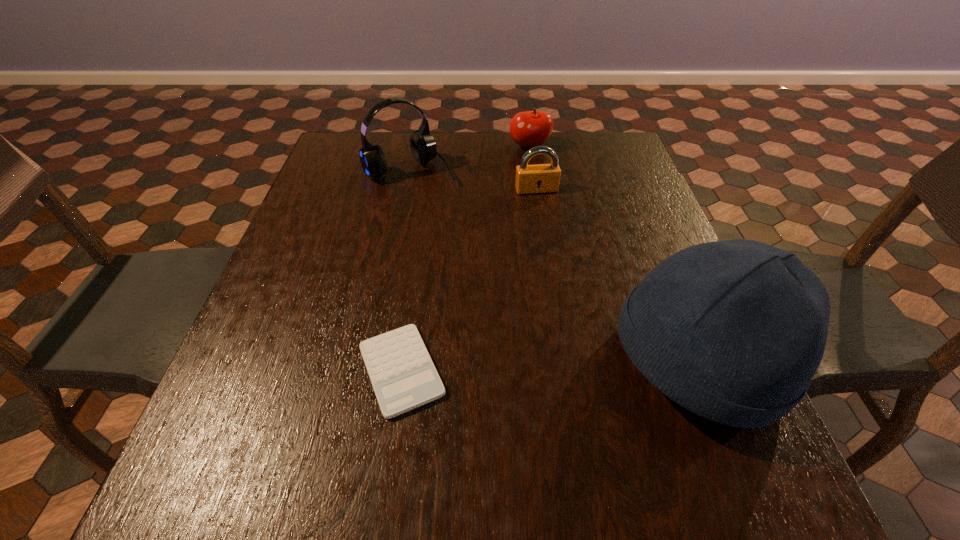
The width and height of the screenshot is (960, 540). In order to click on free space between the second tallest object and the shortest object in this screenshot , I will do `click(406, 270)`.

At what (x,y) coordinates should I click in order to perform the action: click on object that is the closest one to the fourth shortest object. Please return your answer as a coordinate pair (x, y). The height and width of the screenshot is (540, 960). Looking at the image, I should click on (533, 128).

Identify which object is the fourth nearest to the padlock. Please provide its 2D coordinates. Your answer should be formatted as a tuple, i.e. [(x, y)], where the tuple contains the x and y coordinates of a point satisfying the conditions above.

[(403, 376)]

Find the location of `free point that satisfies the following two spatial constraints: 1. on the front side of the tallest object; 2. on the right side of the padlock`. free point that satisfies the following two spatial constraints: 1. on the front side of the tallest object; 2. on the right side of the padlock is located at coordinates (563, 362).

Locate an element on the screen. The height and width of the screenshot is (540, 960). vacant point that satisfies the following two spatial constraints: 1. on the front side of the padlock; 2. on the right side of the rightmost object is located at coordinates [x=563, y=362].

Identify the location of vacant position in the image that satisfies the following two spatial constraints: 1. on the back side of the shortest object; 2. on the left side of the rightmost object. (402, 362).

The height and width of the screenshot is (540, 960). Find the location of `vacant region that satisfies the following two spatial constraints: 1. on the front side of the apple; 2. on the right side of the padlock`. vacant region that satisfies the following two spatial constraints: 1. on the front side of the apple; 2. on the right side of the padlock is located at coordinates (537, 190).